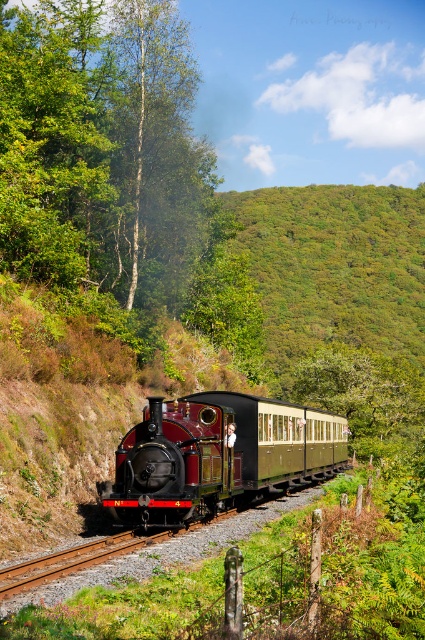
Is smooth bark tree at center positioned in front of polished brass train at center?

No, it is behind polished brass train at center.

Does smooth bark tree at center appear over polished brass train at center?

Yes.

Does point (68, 160) lie in front of point (212, 420)?

No, it is not.

Find the location of a particular element. The height and width of the screenshot is (640, 425). smooth bark tree at center is located at coordinates (102, 148).

Who is more forward, (36, 115) or (175, 506)?

Point (175, 506) is in front.

Does green leafy tree at left appear under polished brass train at center?

Actually, green leafy tree at left is above polished brass train at center.

At what (x,y) coordinates should I click in order to perform the action: click on green leafy tree at left. Please return your answer as a coordinate pair (x, y). This screenshot has height=640, width=425. Looking at the image, I should click on (53, 144).

Between point (95, 276) and point (78, 269), which one is positioned in front?

Point (78, 269) is in front.

Which is above, smooth bark tree at center or green leafy tree at left?

Positioned higher is green leafy tree at left.

Which is behind, point (105, 168) or point (65, 216)?

Positioned behind is point (65, 216).

Where is `smooth bark tree at center`? This screenshot has height=640, width=425. smooth bark tree at center is located at coordinates (102, 148).